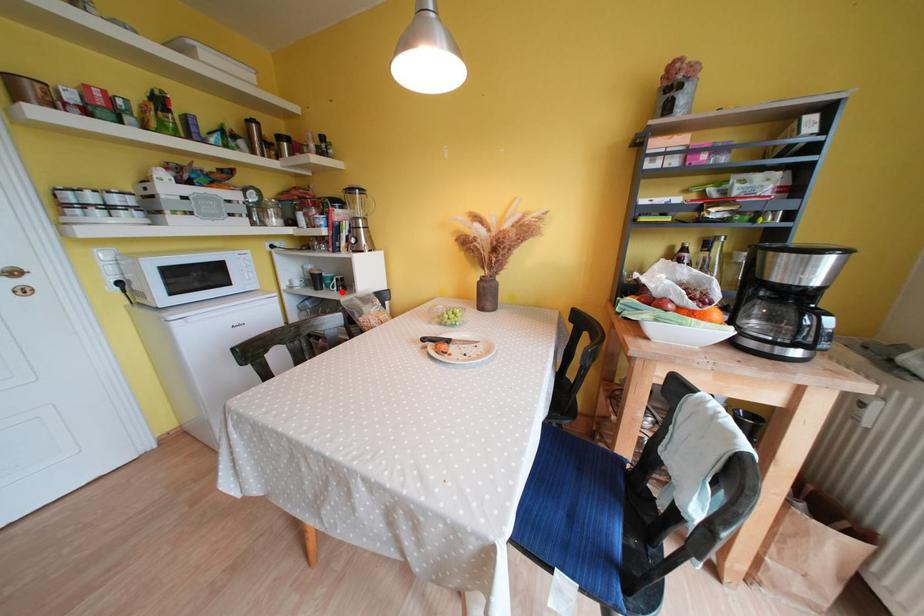
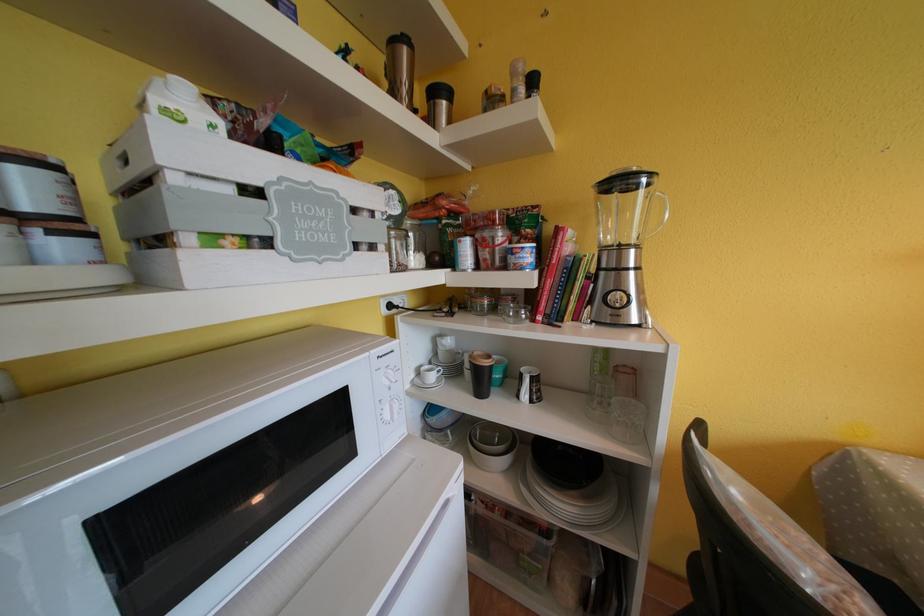
In the second image, find the point that corresponds to the highlighted location in the first image.

(533, 400)